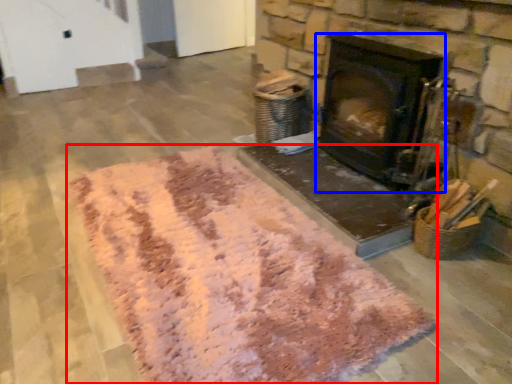
Question: Which of the following is the farthest to the observer, mat (highlighted by a red box) or wood burning stove (highlighted by a blue box)?

Choices:
 (A) mat
 (B) wood burning stove

Answer: (B)